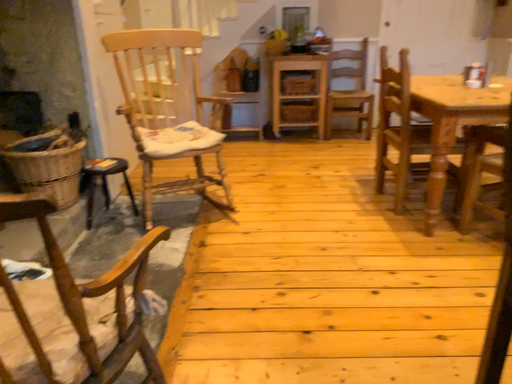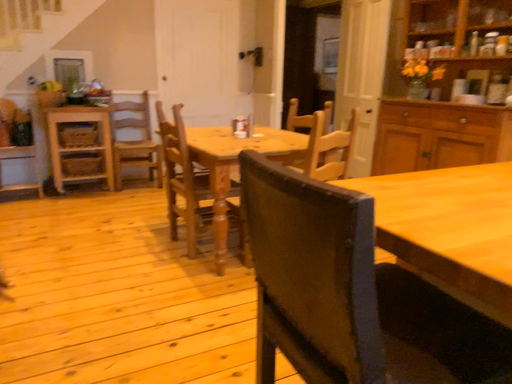
Question: Which way did the camera rotate in the video?

Choices:
 (A) rotated right
 (B) rotated left

Answer: (A)